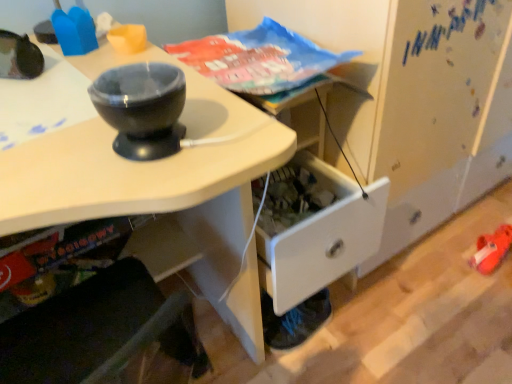
You are a GUI agent. You are given a task and a screenshot of the screen. Output one action in this format:
    pyautogui.click(x=<x>, y=<y>)
    Task: Click on the white glossy desk at center
    The image size is (512, 384).
    Given the screenshot: What is the action you would take?
    pyautogui.click(x=161, y=189)

The height and width of the screenshot is (384, 512). What do you see at coordinates (161, 189) in the screenshot?
I see `white glossy desk at center` at bounding box center [161, 189].

Identify the location of blue fabric shoe at lower right. (294, 321).

This screenshot has width=512, height=384. What do you see at coordinates (294, 321) in the screenshot?
I see `blue fabric shoe at lower right` at bounding box center [294, 321].

Where is `white glossy desk at center`? white glossy desk at center is located at coordinates (161, 189).

Does blue fabric shoe at lower right appear on the right side of white glossy desk at center?

Yes.

Between blue fabric shoe at lower right and white glossy desk at center, which one is positioned in front?

white glossy desk at center is in front.

Does point (266, 297) lie in front of point (79, 188)?

No.

From the image's perspective, would you say blue fabric shoe at lower right is shown under white glossy desk at center?

Correct, blue fabric shoe at lower right appears lower than white glossy desk at center in the image.

From a real-world perspective, who is located lower, blue fabric shoe at lower right or white glossy desk at center?

blue fabric shoe at lower right is physically lower.

Considering the sizes of objects blue fabric shoe at lower right and white glossy desk at center in the image provided, who is thinner, blue fabric shoe at lower right or white glossy desk at center?

With smaller width is blue fabric shoe at lower right.

Considering the relative sizes of blue fabric shoe at lower right and white glossy desk at center in the image provided, is blue fabric shoe at lower right shorter than white glossy desk at center?

Correct, blue fabric shoe at lower right is not as tall as white glossy desk at center.

Looking at the image, does blue fabric shoe at lower right seem bigger or smaller compared to white glossy desk at center?

blue fabric shoe at lower right is smaller than white glossy desk at center.

Can we say blue fabric shoe at lower right lies outside white glossy desk at center?

Yes.

Is the surface of blue fabric shoe at lower right in direct contact with white glossy desk at center?

No.

Is blue fabric shoe at lower right positioned with its back to white glossy desk at center?

No, blue fabric shoe at lower right is not facing away from white glossy desk at center.

Looking at this image, how many degrees apart are the facing directions of blue fabric shoe at lower right and white glossy desk at center?

blue fabric shoe at lower right and white glossy desk at center are facing 179 degrees away from each other.

How much distance is there between blue fabric shoe at lower right and white glossy desk at center?

11.77 inches.

Identify the location of desk in front of the blue fabric shoe at lower right. Image resolution: width=512 pixels, height=384 pixels. (161, 189).

Is white glossy desk at center to the right of blue fabric shoe at lower right from the viewer's perspective?

In fact, white glossy desk at center is to the left of blue fabric shoe at lower right.

Considering their positions, is white glossy desk at center located in front of or behind blue fabric shoe at lower right?

Clearly, white glossy desk at center is in front of blue fabric shoe at lower right.

Does point (173, 242) appear closer or farther from the camera than point (328, 298)?

Point (173, 242) appears to be closer to the viewer than point (328, 298).

Consider the image. From the image's perspective, who appears lower, white glossy desk at center or blue fabric shoe at lower right?

blue fabric shoe at lower right.

From a real-world perspective, relative to blue fabric shoe at lower right, is white glossy desk at center vertically above or below?

From a real-world perspective, white glossy desk at center is physically above blue fabric shoe at lower right.

Is white glossy desk at center wider than blue fabric shoe at lower right?

Yes, white glossy desk at center is wider than blue fabric shoe at lower right.

Which of these two, white glossy desk at center or blue fabric shoe at lower right, stands taller?

white glossy desk at center.

Which of these two, white glossy desk at center or blue fabric shoe at lower right, is bigger?

Bigger between the two is white glossy desk at center.

Is white glossy desk at center spatially inside blue fabric shoe at lower right, or outside of it?

white glossy desk at center is spatially situated outside blue fabric shoe at lower right.

Is white glossy desk at center far from blue fabric shoe at lower right?

Answer: No, there isn't a large distance between white glossy desk at center and blue fabric shoe at lower right.

Could you tell me if white glossy desk at center is facing blue fabric shoe at lower right?

No, white glossy desk at center is not oriented towards blue fabric shoe at lower right.

How many degrees apart are the facing directions of white glossy desk at center and blue fabric shoe at lower right?

179 degrees.

Where is `footwear behind the white glossy desk at center`? The width and height of the screenshot is (512, 384). footwear behind the white glossy desk at center is located at coordinates (294, 321).

Image resolution: width=512 pixels, height=384 pixels. I want to click on desk in front of the blue fabric shoe at lower right, so click(x=161, y=189).

You are a GUI agent. You are given a task and a screenshot of the screen. Output one action in this format:
    pyautogui.click(x=<x>, y=<y>)
    Task: Click on the desk that appears on the left of blue fabric shoe at lower right
    This screenshot has height=384, width=512.
    Given the screenshot: What is the action you would take?
    pyautogui.click(x=161, y=189)